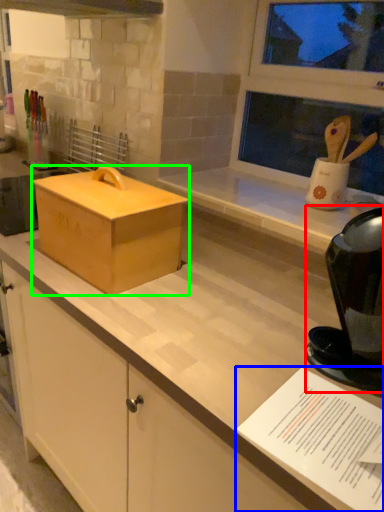
Question: Which is farther away from appliance (highlighted by a red box)? paper (highlighted by a blue box) or box (highlighted by a green box)?

Choices:
 (A) paper
 (B) box

Answer: (B)